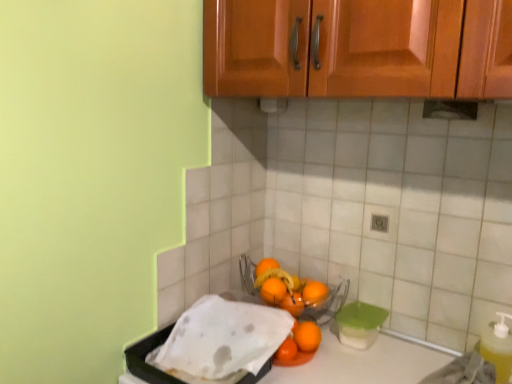
Question: Is orange matte bowl at center, which is counted as the second wash, starting from the left, positioned with its back to orange matte at lower center, the 1th orange in the top-to-bottom sequence?

Choices:
 (A) yes
 (B) no

Answer: (A)

Question: Is orange matte bowl at center, which is counted as the second wash, starting from the left, taller than orange matte at lower center, positioned as the 5th orange in bottom-to-top order?

Choices:
 (A) no
 (B) yes

Answer: (B)

Question: Is orange matte bowl at center, positioned as the 1th wash in right-to-left order, at the right side of orange matte at lower center, the 1th orange in the top-to-bottom sequence?

Choices:
 (A) yes
 (B) no

Answer: (A)

Question: Does orange matte bowl at center, positioned as the 1th wash in right-to-left order, turn towards orange matte at lower center, positioned as the 5th orange in bottom-to-top order?

Choices:
 (A) yes
 (B) no

Answer: (B)

Question: From the image's perspective, is orange matte bowl at center, which is counted as the second wash, starting from the left, below orange matte at lower center, the 1th orange in the top-to-bottom sequence?

Choices:
 (A) yes
 (B) no

Answer: (A)

Question: Are orange matte bowl at center, which is counted as the second wash, starting from the left, and orange matte at lower center, positioned as the 5th orange in bottom-to-top order, located far from each other?

Choices:
 (A) yes
 (B) no

Answer: (B)

Question: Considering the relative sizes of orange matte at center, placed as the second orange when sorted from top to bottom, and orange matte at center, marked as the 4th orange in a top-to-bottom arrangement, in the image provided, is orange matte at center, placed as the second orange when sorted from top to bottom, smaller than orange matte at center, marked as the 4th orange in a top-to-bottom arrangement,?

Choices:
 (A) no
 (B) yes

Answer: (A)

Question: Does orange matte at center, the 4th orange when ordered from bottom to top, appear on the right side of orange matte at center, the 2th orange positioned from the bottom?

Choices:
 (A) yes
 (B) no

Answer: (B)

Question: Is orange matte at center, the 4th orange when ordered from bottom to top, shorter than orange matte at center, the 2th orange positioned from the bottom?

Choices:
 (A) yes
 (B) no

Answer: (B)

Question: From the image's perspective, is orange matte at center, placed as the second orange when sorted from top to bottom, beneath orange matte at center, marked as the 4th orange in a top-to-bottom arrangement?

Choices:
 (A) no
 (B) yes

Answer: (A)

Question: Is orange matte at center, the 4th orange when ordered from bottom to top, next to orange matte at center, marked as the 4th orange in a top-to-bottom arrangement, and touching it?

Choices:
 (A) yes
 (B) no

Answer: (A)

Question: Are orange matte at center, placed as the second orange when sorted from top to bottom, and orange matte at center, the 2th orange positioned from the bottom, far apart?

Choices:
 (A) yes
 (B) no

Answer: (B)

Question: From the image's perspective, is orange matte at lower center, the 1th orange in the top-to-bottom sequence, on orange matte at center, the third orange when ordered from top to bottom?

Choices:
 (A) yes
 (B) no

Answer: (A)